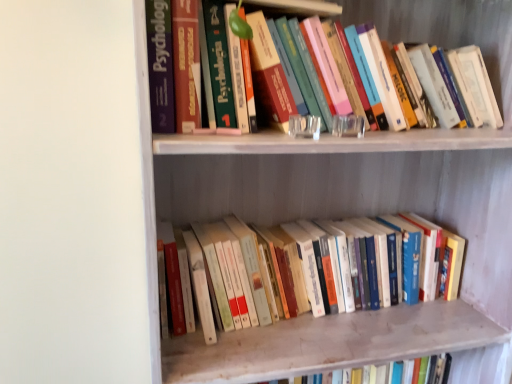
Question: Does hardcover book at upper center, the 2th book from the bottom, have a greater height compared to wooden bookshelf at upper center?

Choices:
 (A) no
 (B) yes

Answer: (A)

Question: From a real-world perspective, is hardcover book at upper center, the 2th book from the bottom, located higher than wooden bookshelf at upper center?

Choices:
 (A) no
 (B) yes

Answer: (B)

Question: Can you confirm if hardcover book at upper center, which ranks as the 1th book in top-to-bottom order, is shorter than wooden bookshelf at upper center?

Choices:
 (A) no
 (B) yes

Answer: (B)

Question: Does hardcover book at upper center, which ranks as the 1th book in top-to-bottom order, appear on the right side of wooden bookshelf at upper center?

Choices:
 (A) no
 (B) yes

Answer: (A)

Question: Considering the relative sizes of hardcover book at upper center, which ranks as the 1th book in top-to-bottom order, and wooden bookshelf at upper center in the image provided, is hardcover book at upper center, which ranks as the 1th book in top-to-bottom order, wider than wooden bookshelf at upper center?

Choices:
 (A) no
 (B) yes

Answer: (A)

Question: From the image's perspective, is hardcover book at upper center, the 2th book from the bottom, above or below hardcover books at lower center, arranged as the 1th book when ordered from the bottom?

Choices:
 (A) above
 (B) below

Answer: (A)

Question: Which is correct: hardcover book at upper center, the 2th book from the bottom, is inside hardcover books at lower center, arranged as the 1th book when ordered from the bottom, or outside of it?

Choices:
 (A) inside
 (B) outside

Answer: (B)

Question: Considering the positions of point click(x=489, y=21) and point click(x=290, y=278), is point click(x=489, y=21) closer or farther from the camera than point click(x=290, y=278)?

Choices:
 (A) farther
 (B) closer

Answer: (B)

Question: Visually, is hardcover book at upper center, the 2th book from the bottom, positioned to the left or to the right of hardcover books at lower center, which is the second book from top to bottom?

Choices:
 (A) left
 (B) right

Answer: (B)

Question: In terms of width, does hardcover books at lower center, which is the second book from top to bottom, look wider or thinner when compared to wooden bookshelf at upper center?

Choices:
 (A) thin
 (B) wide

Answer: (A)

Question: Is hardcover books at lower center, which is the second book from top to bottom, to the left or to the right of wooden bookshelf at upper center in the image?

Choices:
 (A) left
 (B) right

Answer: (A)

Question: Is point (291, 304) closer or farther from the camera than point (245, 180)?

Choices:
 (A) closer
 (B) farther

Answer: (A)

Question: Choose the correct answer: Is hardcover books at lower center, which is the second book from top to bottom, inside wooden bookshelf at upper center or outside it?

Choices:
 (A) inside
 (B) outside

Answer: (A)

Question: Is hardcover books at lower center, arranged as the 1th book when ordered from the bottom, wider or thinner than hardcover book at upper center, which ranks as the 1th book in top-to-bottom order?

Choices:
 (A) wide
 (B) thin

Answer: (B)

Question: Considering the positions of point (352, 243) and point (495, 46), is point (352, 243) closer or farther from the camera than point (495, 46)?

Choices:
 (A) closer
 (B) farther

Answer: (B)